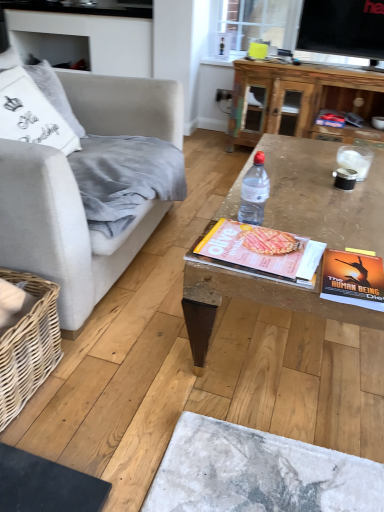
Image resolution: width=384 pixels, height=512 pixels. Find the location of `free spot above wooden coffee table at center (from a real-world perspective)`. free spot above wooden coffee table at center (from a real-world perspective) is located at coordinates (324, 197).